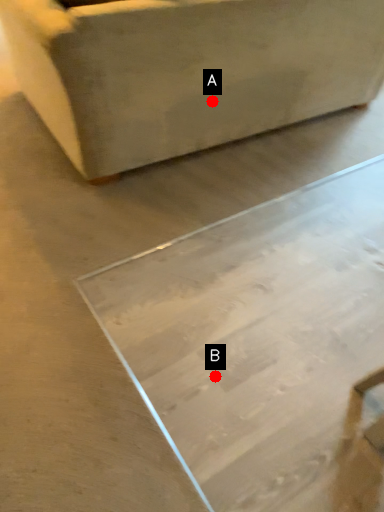
Question: Two points are circled on the image, labeled by A and B beside each circle. Which point appears closest to the camera in this image?

Choices:
 (A) A is closer
 (B) B is closer

Answer: (B)